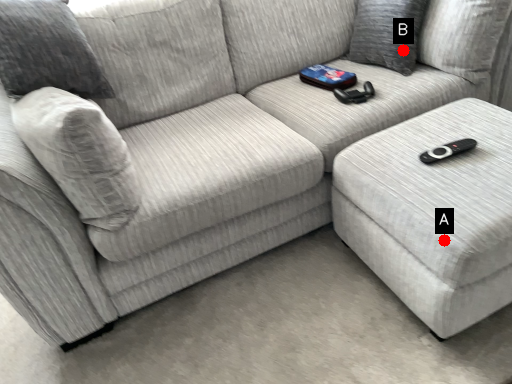
Question: Two points are circled on the image, labeled by A and B beside each circle. Which point is further to the camera?

Choices:
 (A) A is further
 (B) B is further

Answer: (B)